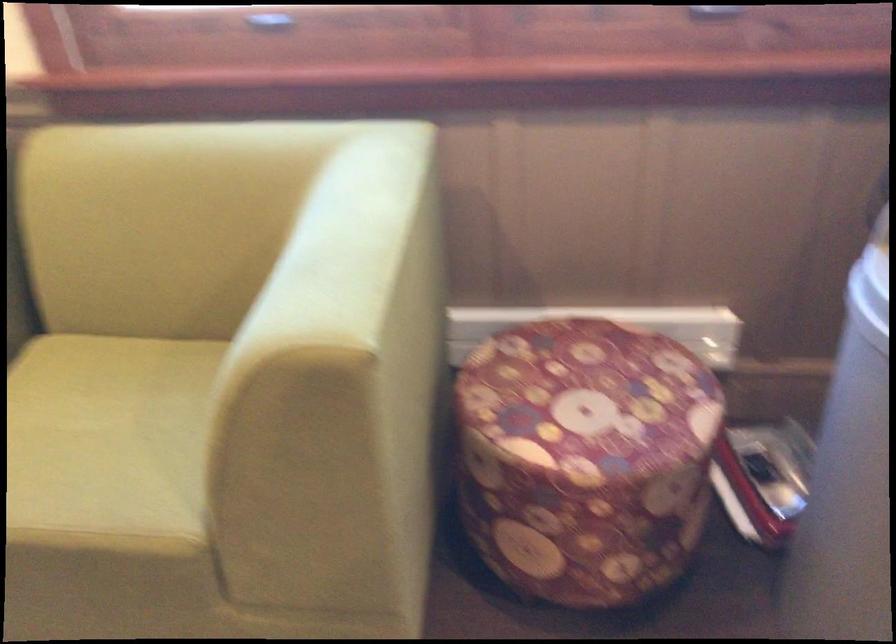
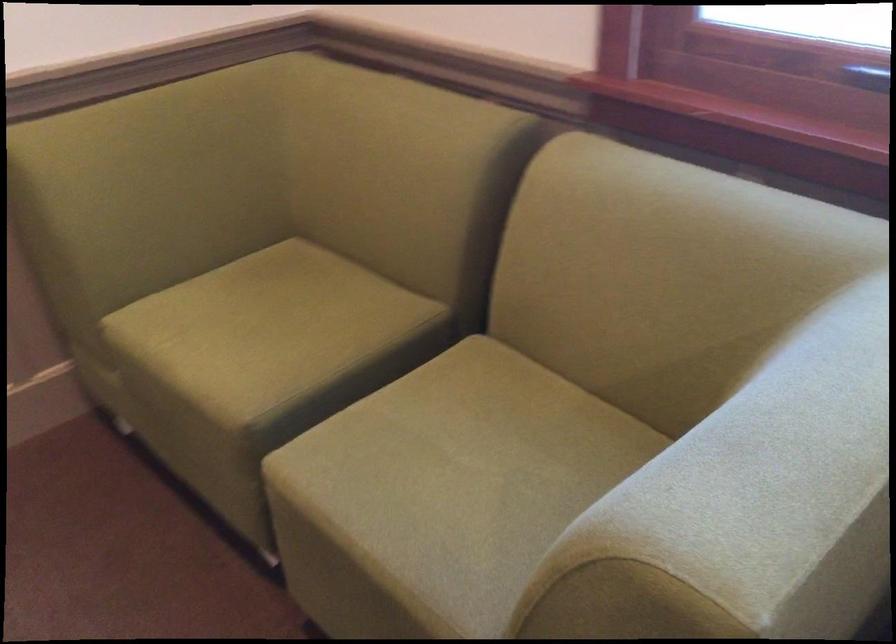
Question: The first image is from the beginning of the video and the second image is from the end. How did the camera likely rotate when shooting the video?

Choices:
 (A) Left
 (B) Right
 (C) Up
 (D) Down

Answer: (A)